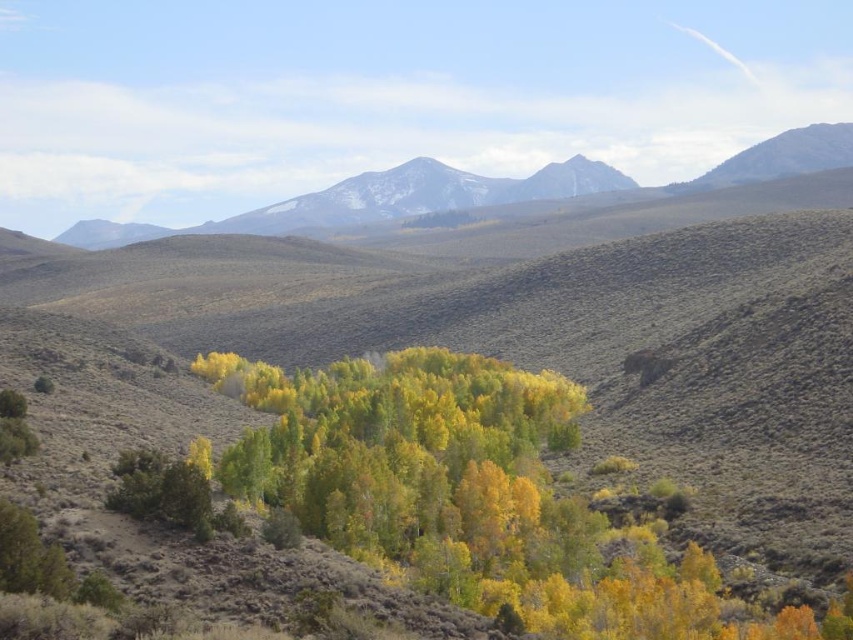
Question: Among these objects, which one is farthest from the camera?

Choices:
 (A) snowy granite mountain range at upper center
 (B) yellow-green foliage at center

Answer: (A)

Question: Is yellow-green foliage at center above snowy granite mountain range at upper center?

Choices:
 (A) yes
 (B) no

Answer: (B)

Question: Is yellow-green foliage at center further to camera compared to snowy granite mountain range at upper center?

Choices:
 (A) yes
 (B) no

Answer: (B)

Question: Does yellow-green foliage at center appear on the left side of snowy granite mountain range at upper center?

Choices:
 (A) yes
 (B) no

Answer: (B)

Question: Among these points, which one is farthest from the camera?

Choices:
 (A) [447, 349]
 (B) [434, 173]

Answer: (B)